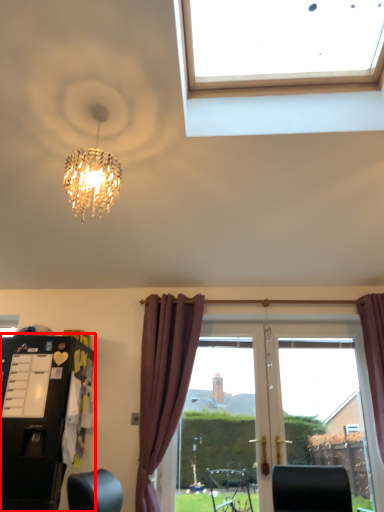
Question: Where is dresser (annotated by the red box) located in relation to curtain in the image?

Choices:
 (A) right
 (B) left

Answer: (B)